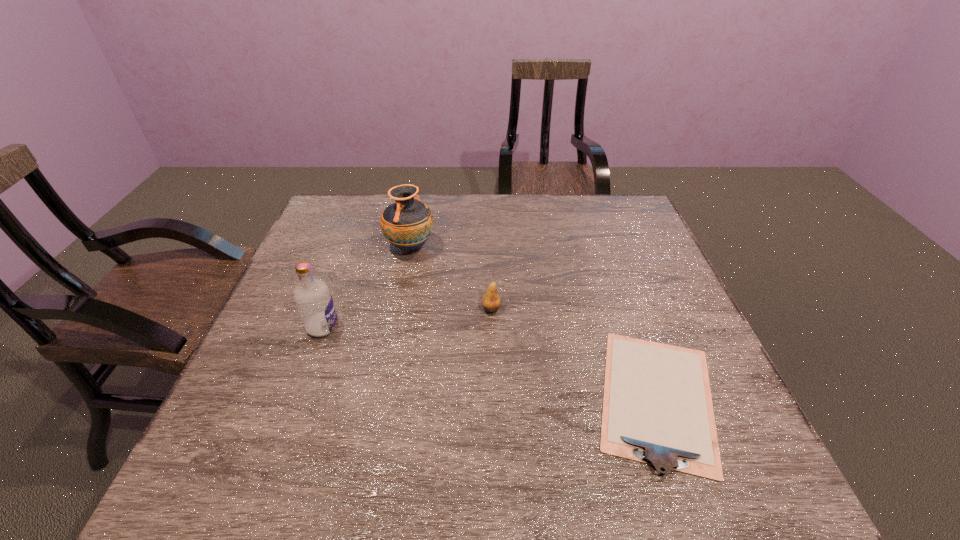
In order to click on vacant space located 0.400m on the back of the rightmost object in this screenshot , I will do point(600,236).

I want to click on object at the far edge, so click(407, 224).

I want to click on object present at the near edge, so click(657, 407).

Where is `object that is at the left edge`? object that is at the left edge is located at coordinates (314, 302).

Identify the location of object situated at the right edge. The height and width of the screenshot is (540, 960). 657,407.

Image resolution: width=960 pixels, height=540 pixels. What are the coordinates of `object situated at the near right corner` in the screenshot? It's located at (657, 407).

At what (x,y) coordinates should I click in order to perform the action: click on vacant area at the far edge. Please return your answer as a coordinate pair (x, y). Image resolution: width=960 pixels, height=540 pixels. Looking at the image, I should click on (369, 220).

At what (x,y) coordinates should I click in order to perform the action: click on free space at the near edge. Please return your answer as a coordinate pair (x, y). Looking at the image, I should click on (327, 460).

Locate an element on the screen. The image size is (960, 540). vacant space at the left edge is located at coordinates (282, 298).

This screenshot has width=960, height=540. I want to click on blank space at the right edge of the desktop, so click(653, 289).